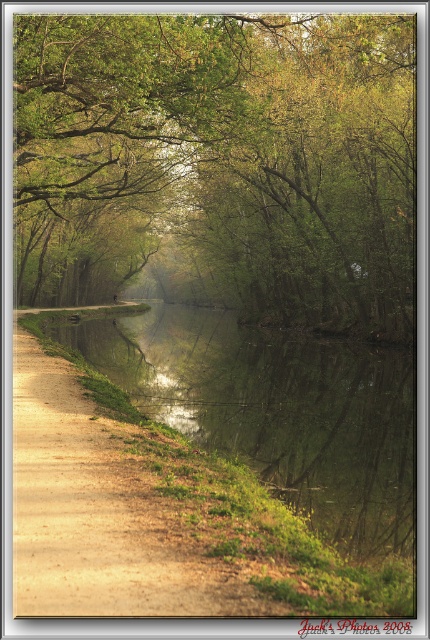
Question: Among these objects, which one is nearest to the camera?

Choices:
 (A) green leafy trees at center
 (B) green reflective water at center
 (C) brown dirt path at left

Answer: (C)

Question: Estimate the real-world distances between objects in this image. Which object is farther from the green leafy trees at center?

Choices:
 (A) brown dirt path at left
 (B) green reflective water at center

Answer: (A)

Question: Where is green reflective water at center located in relation to brown dirt path at left in the image?

Choices:
 (A) above
 (B) below

Answer: (A)

Question: Does green reflective water at center have a larger size compared to brown dirt path at left?

Choices:
 (A) yes
 (B) no

Answer: (A)

Question: Which of these objects is positioned closest to the green reflective water at center?

Choices:
 (A) green leafy trees at center
 (B) brown dirt path at left

Answer: (B)

Question: In this image, where is green leafy trees at center located relative to brown dirt path at left?

Choices:
 (A) above
 (B) below

Answer: (A)